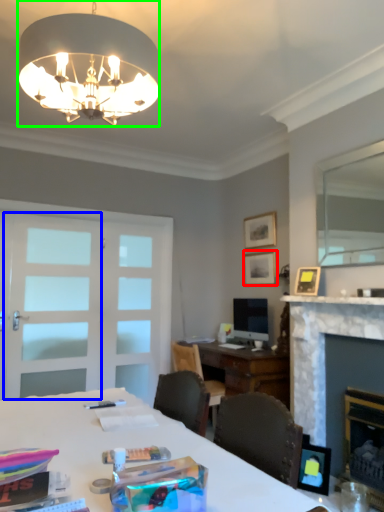
Question: Which is nearer to the picture frame (highlighted by a red box)? screen door (highlighted by a blue box) or lamp (highlighted by a green box).

Choices:
 (A) screen door
 (B) lamp

Answer: (A)